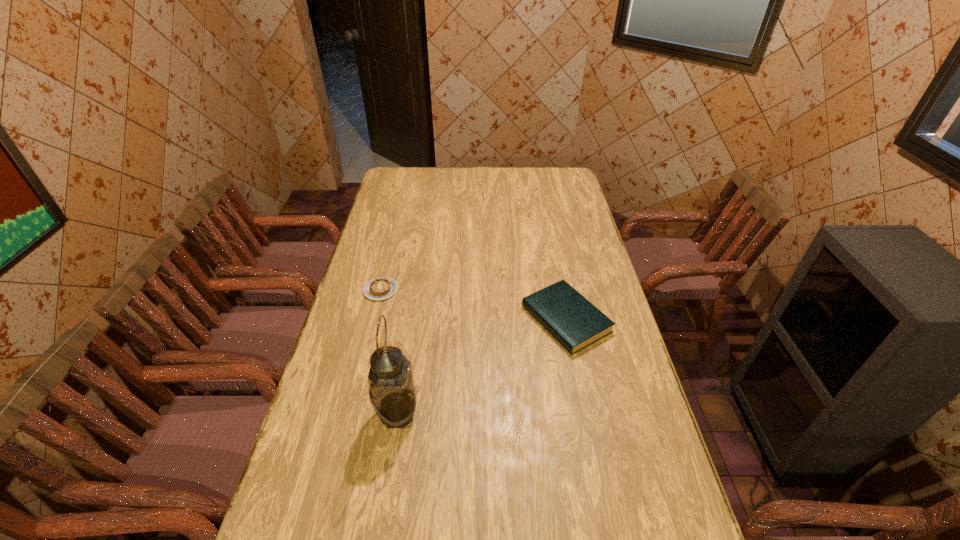
This screenshot has height=540, width=960. Find the location of `the second closest object to the second object from left to right`. the second closest object to the second object from left to right is located at coordinates (380, 288).

Identify which object is located as the nearest to the shortest object. Please provide its 2D coordinates. Your answer should be formatted as a tuple, i.e. [(x, y)], where the tuple contains the x and y coordinates of a point satisfying the conditions above.

[(392, 393)]

The image size is (960, 540). Identify the location of blank space that satisfies the following two spatial constraints: 1. on the front side of the quiche; 2. on the right side of the second shortest object. (373, 319).